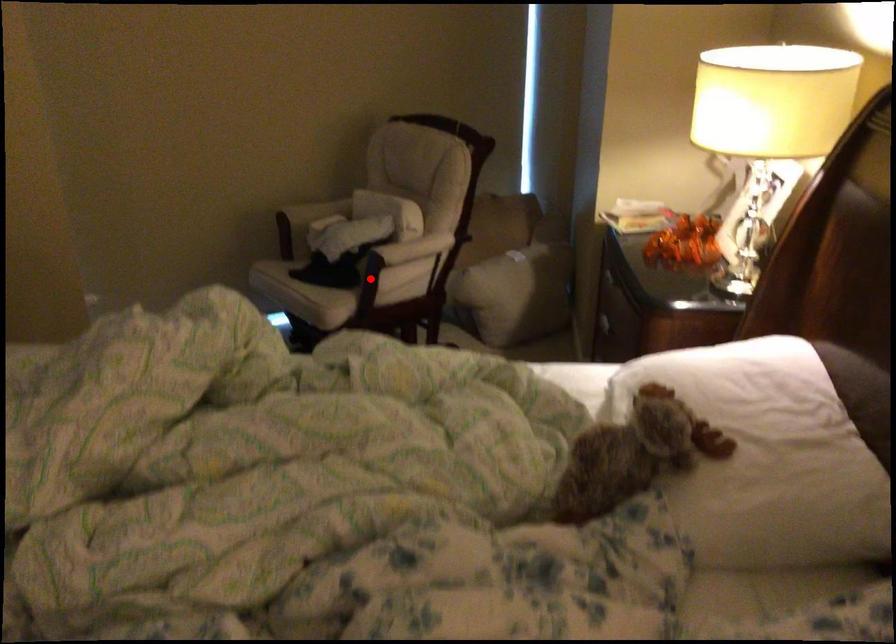
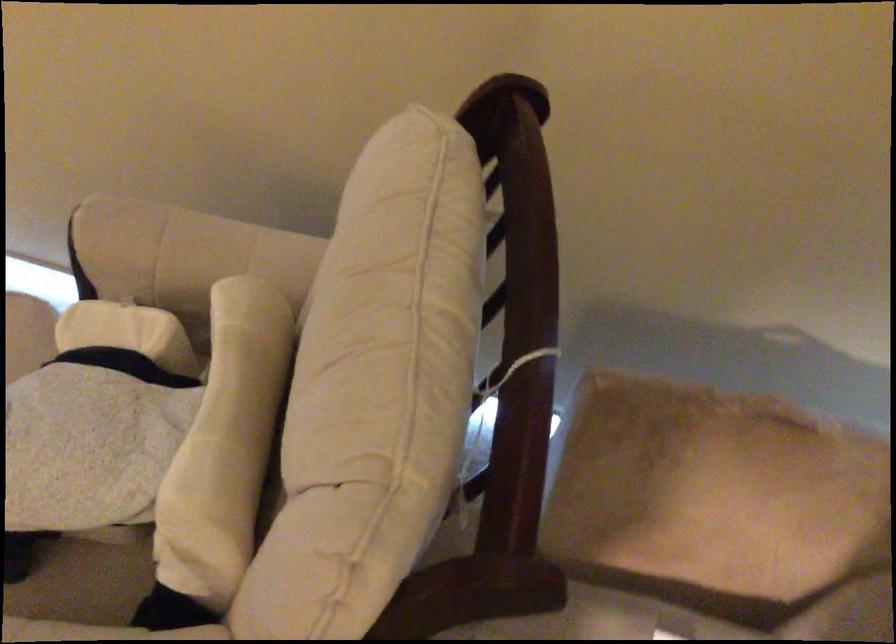
Question: I am providing you with two images of the same scene from different viewpoints. Given a red point in image1, look at the same physical point in image2. Is it:

Choices:
 (A) Closer to the viewpoint
 (B) Farther from the viewpoint

Answer: (A)